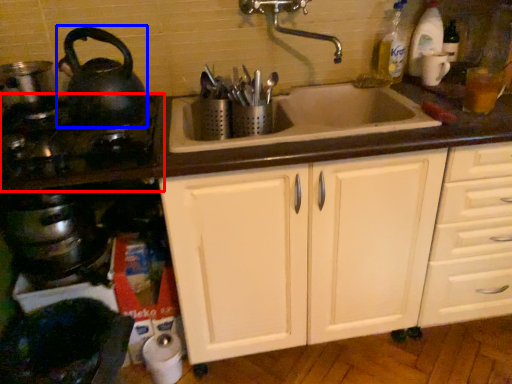
Question: Which of the following is the closest to the observer, gas stove (highlighted by a red box) or tea pot (highlighted by a blue box)?

Choices:
 (A) gas stove
 (B) tea pot

Answer: (A)